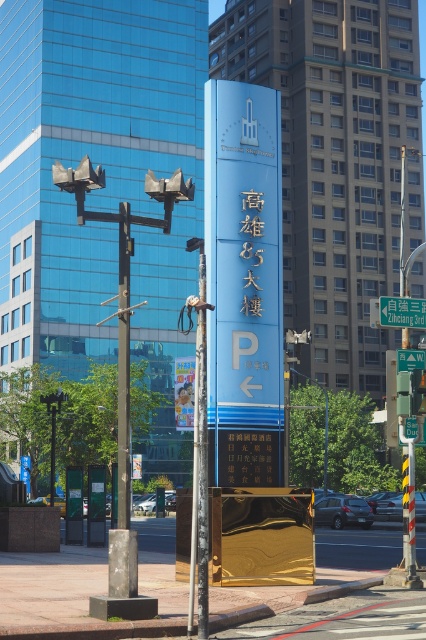
You are a city planner assessing the placement of the metallic pole at center and the blue metallic street sign at center. Which object would require a taller support structure?

The metallic pole at center requires a taller support structure because it is taller than the blue metallic street sign at center.

You are standing at the origin point in the image. Which direction should you move to reach the metallic pole at center?

The metallic pole at center is located at coordinates point (x=199, y=456), so you should move towards the right and slightly upward to reach it.